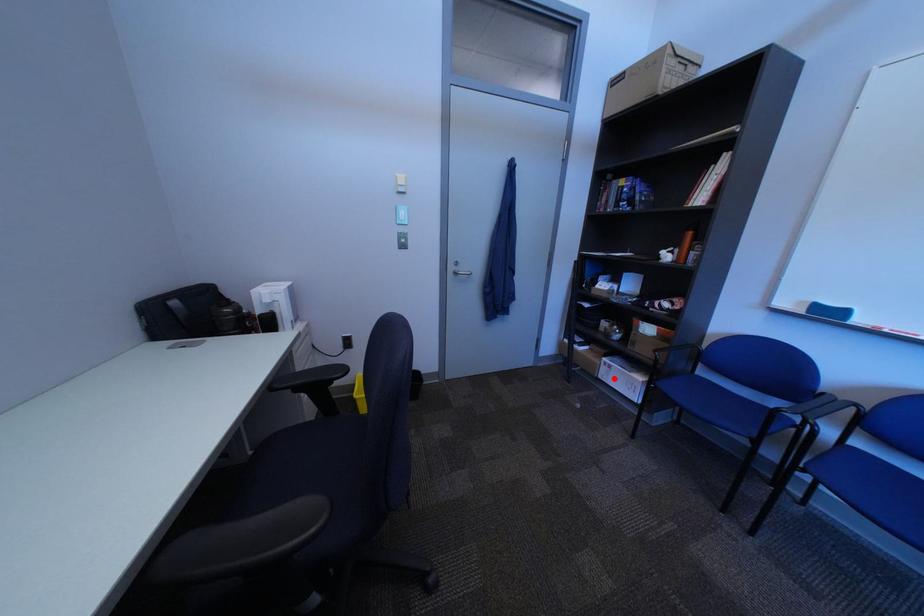
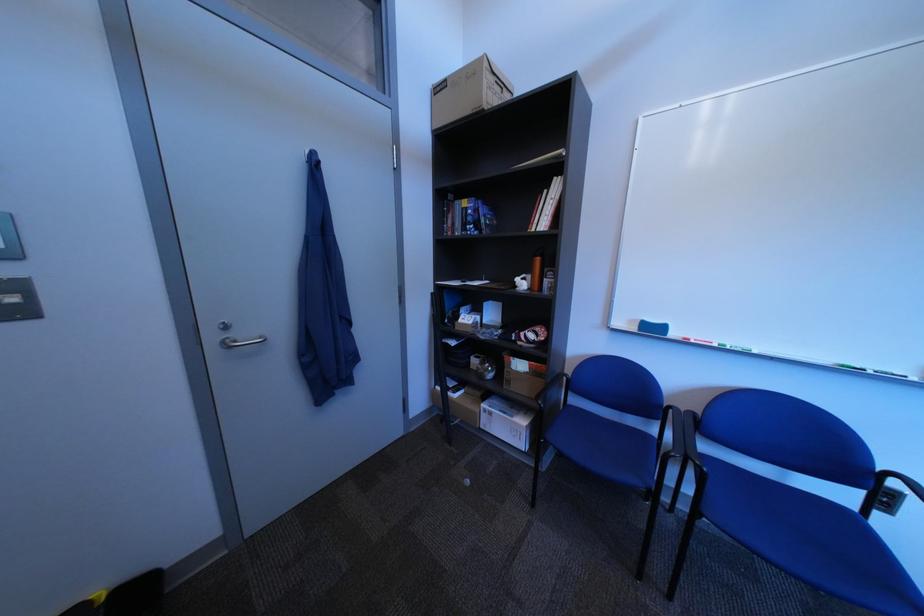
Find the pixel in the second image that matches the highlighted location in the first image.

(496, 429)